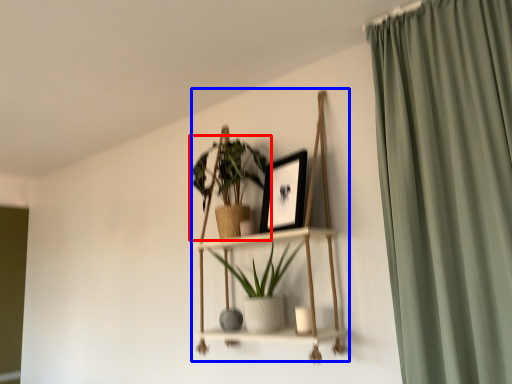
Question: Which object appears farthest to the camera in this image, houseplant (highlighted by a red box) or cabinet (highlighted by a blue box)?

Choices:
 (A) houseplant
 (B) cabinet

Answer: (A)